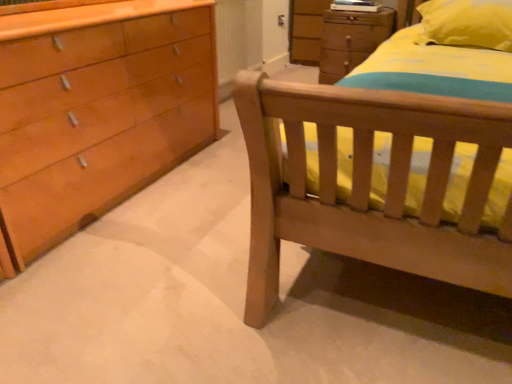
This screenshot has height=384, width=512. What do you see at coordinates (351, 40) in the screenshot?
I see `wooden chest of drawers at upper center` at bounding box center [351, 40].

Where is `wooden chest of drawers at upper center`? The image size is (512, 384). wooden chest of drawers at upper center is located at coordinates (351, 40).

At what (x,y) coordinates should I click in order to perform the action: click on yellow fabric pillow at upper right. Please return your answer as a coordinate pair (x, y). Looking at the image, I should click on (468, 23).

Measure the distance between point (483, 22) and camera.

Point (483, 22) is 2.14 meters away from camera.

Describe the element at coordinates (468, 23) in the screenshot. I see `yellow fabric pillow at upper right` at that location.

You are a GUI agent. You are given a task and a screenshot of the screen. Output one action in this format:
    pyautogui.click(x=<x>, y=<y>)
    Task: Click on the wooden chest of drawers at upper center
    
    Given the screenshot: What is the action you would take?
    pyautogui.click(x=351, y=40)

Is yellow fabric pillow at upper right at the right side of wooden chest of drawers at upper center?

Indeed, yellow fabric pillow at upper right is positioned on the right side of wooden chest of drawers at upper center.

Considering the positions of objects yellow fabric pillow at upper right and wooden chest of drawers at upper center in the image provided, who is in front, yellow fabric pillow at upper right or wooden chest of drawers at upper center?

Positioned in front is yellow fabric pillow at upper right.

Is point (456, 16) farther from camera compared to point (340, 59)?

No, (456, 16) is closer to viewer.

From the image's perspective, between yellow fabric pillow at upper right and wooden chest of drawers at upper center, who is located below?

yellow fabric pillow at upper right appears lower in the image.

From a real-world perspective, is yellow fabric pillow at upper right physically above wooden chest of drawers at upper center?

Yes.

Considering the sizes of objects yellow fabric pillow at upper right and wooden chest of drawers at upper center in the image provided, who is wider, yellow fabric pillow at upper right or wooden chest of drawers at upper center?

Wider between the two is yellow fabric pillow at upper right.

Between yellow fabric pillow at upper right and wooden chest of drawers at upper center, which one has less height?

With less height is yellow fabric pillow at upper right.

Who is bigger, yellow fabric pillow at upper right or wooden chest of drawers at upper center?

wooden chest of drawers at upper center is bigger.

Is wooden chest of drawers at upper center a part of yellow fabric pillow at upper right?

Definitely not — wooden chest of drawers at upper center is not inside yellow fabric pillow at upper right.

Are yellow fabric pillow at upper right and wooden chest of drawers at upper center beside each other?

No, yellow fabric pillow at upper right is not with wooden chest of drawers at upper center.

Could you tell me if yellow fabric pillow at upper right is facing wooden chest of drawers at upper center?

No, yellow fabric pillow at upper right is not oriented towards wooden chest of drawers at upper center.

How many degrees apart are the facing directions of yellow fabric pillow at upper right and wooden chest of drawers at upper center?

There is a 0.634-degree angle between the facing directions of yellow fabric pillow at upper right and wooden chest of drawers at upper center.

At what (x,y) coordinates should I click in order to perform the action: click on chest of drawers behind the yellow fabric pillow at upper right. Please return your answer as a coordinate pair (x, y). Looking at the image, I should click on (351, 40).

Considering the positions of objects wooden chest of drawers at upper center and yellow fabric pillow at upper right in the image provided, who is more to the right, wooden chest of drawers at upper center or yellow fabric pillow at upper right?

yellow fabric pillow at upper right.

Between wooden chest of drawers at upper center and yellow fabric pillow at upper right, which one is positioned in front?

Positioned in front is yellow fabric pillow at upper right.

Between point (353, 26) and point (456, 41), which one is positioned in front?

The point (456, 41) is closer.

From the image's perspective, would you say wooden chest of drawers at upper center is shown under yellow fabric pillow at upper right?

No.

From a real-world perspective, which object rests below the other?

wooden chest of drawers at upper center is physically lower.

From the picture: Considering the relative sizes of wooden chest of drawers at upper center and yellow fabric pillow at upper right in the image provided, is wooden chest of drawers at upper center thinner than yellow fabric pillow at upper right?

Indeed, wooden chest of drawers at upper center has a lesser width compared to yellow fabric pillow at upper right.

Is wooden chest of drawers at upper center taller or shorter than yellow fabric pillow at upper right?

wooden chest of drawers at upper center is taller than yellow fabric pillow at upper right.

Which of these two, wooden chest of drawers at upper center or yellow fabric pillow at upper right, is bigger?

wooden chest of drawers at upper center.

Can yellow fabric pillow at upper right be found inside wooden chest of drawers at upper center?

No, yellow fabric pillow at upper right is not inside wooden chest of drawers at upper center.

Consider the image. Is wooden chest of drawers at upper center next to yellow fabric pillow at upper right and touching it?

No, wooden chest of drawers at upper center is not beside yellow fabric pillow at upper right.

Is wooden chest of drawers at upper center oriented away from yellow fabric pillow at upper right?

No.

How many degrees apart are the facing directions of wooden chest of drawers at upper center and yellow fabric pillow at upper right?

There is a 0.634-degree angle between the facing directions of wooden chest of drawers at upper center and yellow fabric pillow at upper right.

Identify the location of pillow lying in front of the wooden chest of drawers at upper center. (468, 23).

Find the location of a particular element. The height and width of the screenshot is (384, 512). pillow that is above the wooden chest of drawers at upper center (from a real-world perspective) is located at coordinates (468, 23).

I want to click on pillow below the wooden chest of drawers at upper center (from the image's perspective), so click(x=468, y=23).